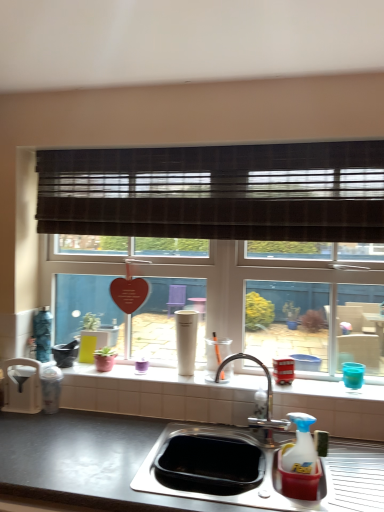
Image resolution: width=384 pixels, height=512 pixels. Identify the location of vacant space to the left of blue plastic cup at right, which ranks as the 1th appliance in right-to-left order. (323, 388).